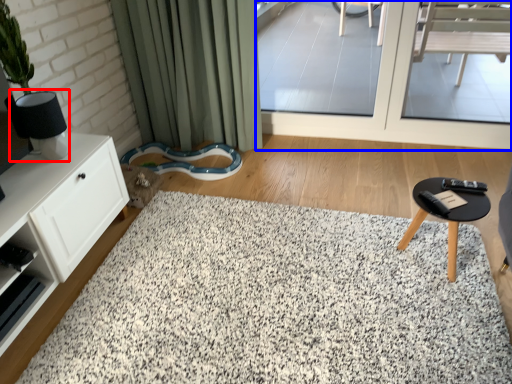
Question: Which object appears farthest to the camera in this image, lamp (highlighted by a red box) or window screen (highlighted by a blue box)?

Choices:
 (A) lamp
 (B) window screen

Answer: (B)